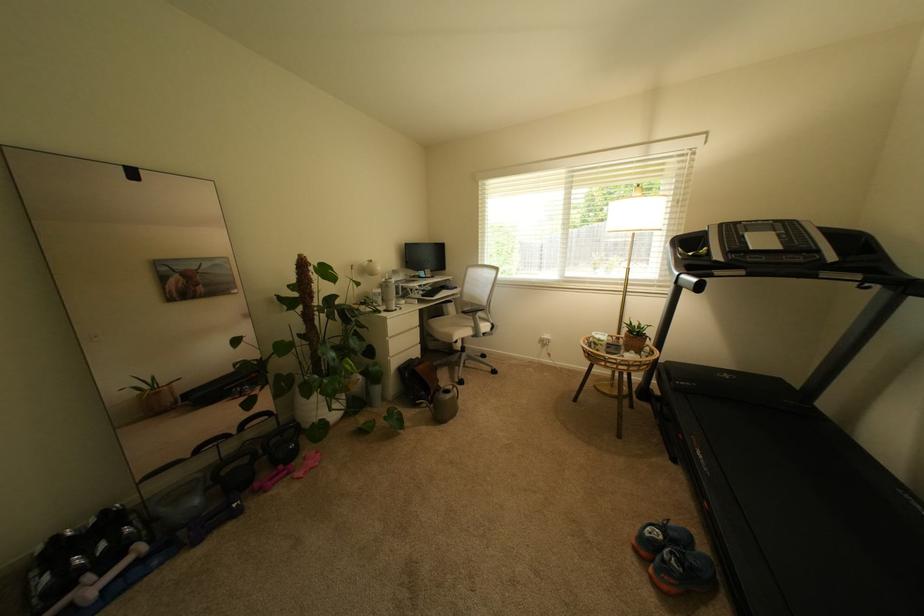
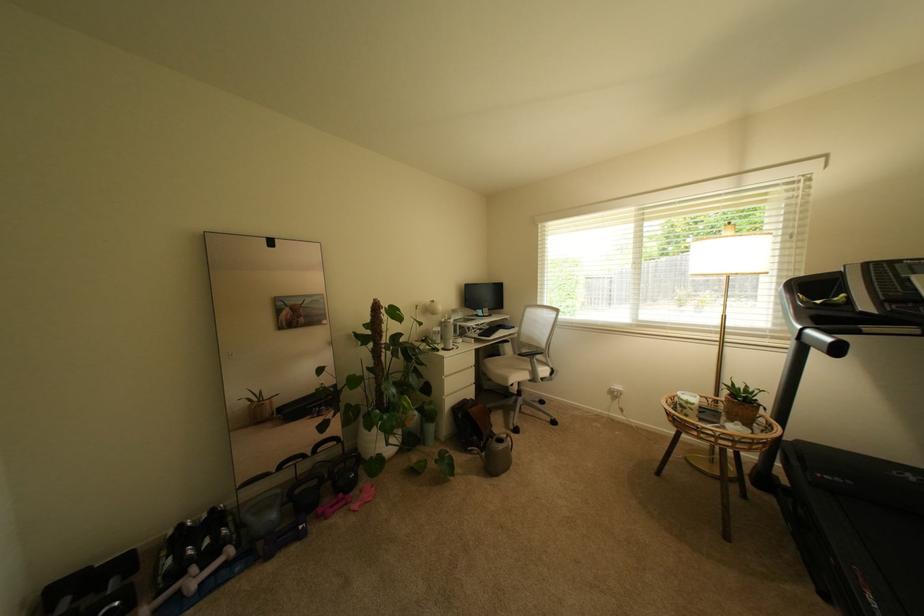
Find the pixel in the second image that matches pixel 112 546 in the first image.

(215, 543)